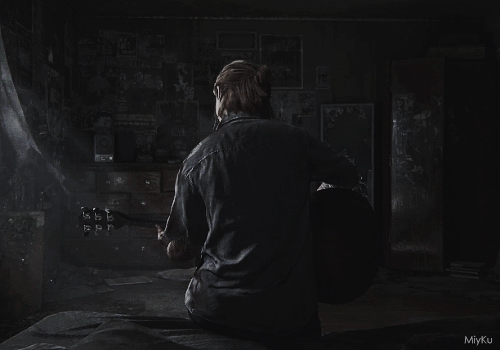
You are a GUI agent. You are given a task and a screenshot of the screen. Output one action in this format:
    pyautogui.click(x=<x>, y=<y>)
    Task: Click on the drawer pulls
    
    Given the screenshot: What is the action you would take?
    pyautogui.click(x=147, y=182), pyautogui.click(x=119, y=179), pyautogui.click(x=80, y=182), pyautogui.click(x=79, y=202), pyautogui.click(x=113, y=202), pyautogui.click(x=142, y=203), pyautogui.click(x=142, y=248), pyautogui.click(x=117, y=249), pyautogui.click(x=77, y=249)